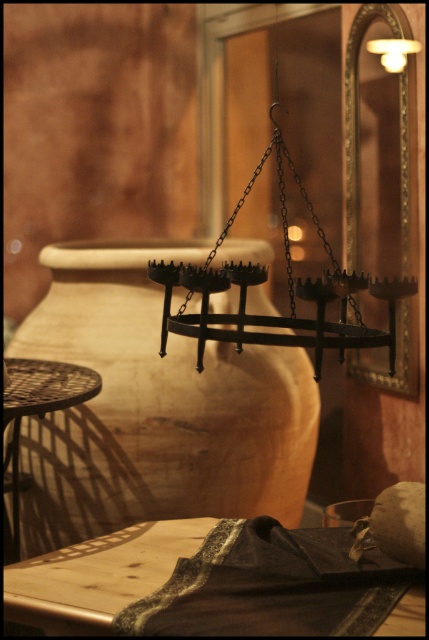
Can you confirm if metallic mesh table at lower left is bigger than matte white light fixture at upper right?

Yes, metallic mesh table at lower left is bigger than matte white light fixture at upper right.

Can you confirm if metallic mesh table at lower left is wider than matte white light fixture at upper right?

Indeed, metallic mesh table at lower left has a greater width compared to matte white light fixture at upper right.

Between point (36, 387) and point (383, 61), which one is positioned in front?

Point (36, 387) is more forward.

What are the coordinates of `metallic mesh table at lower left` in the screenshot? It's located at (38, 406).

Is matte black chandelier at upper center shorter than matte white light fixture at upper right?

No, matte black chandelier at upper center is not shorter than matte white light fixture at upper right.

Is matte black chandelier at upper center below matte white light fixture at upper right?

Yes, matte black chandelier at upper center is below matte white light fixture at upper right.

Locate an element on the screen. matte black chandelier at upper center is located at coordinates (154, 408).

Is wooden table at lower left bigger than metallic mesh table at lower left?

Actually, wooden table at lower left might be smaller than metallic mesh table at lower left.

Does point (154, 564) lie behind point (12, 435)?

No, (154, 564) is closer to viewer.

Image resolution: width=429 pixels, height=640 pixels. I want to click on wooden table at lower left, so click(100, 572).